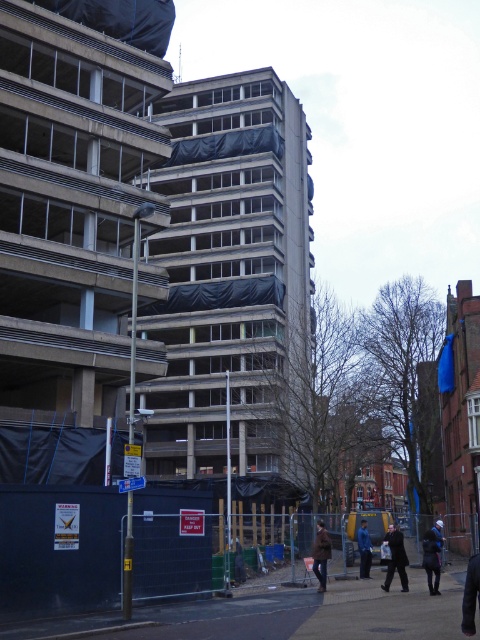
Question: Which point is closer to the camera?

Choices:
 (A) brown asphalt pavement at lower center
 (B) dark blue jeans at lower right

Answer: (B)

Question: From the image, what is the correct spatial relationship of dark gray coat at center in relation to dark blue jacket at lower right?

Choices:
 (A) below
 (B) above

Answer: (A)

Question: Among these objects, which one is farthest from the camera?

Choices:
 (A) dark blue jacket at lower right
 (B) dark blue jeans at lower right
 (C) blue denim jacket at lower right

Answer: (C)

Question: Can you confirm if brown woolen coat at lower right is wider than blue denim jacket at lower right?

Choices:
 (A) no
 (B) yes

Answer: (B)

Question: Is dark gray coat at center wider than brown woolen coat at lower right?

Choices:
 (A) no
 (B) yes

Answer: (B)

Question: Which object is positioned closest to the brown asphalt pavement at lower center?

Choices:
 (A) dark blue jeans at lower right
 (B) brown woolen coat at lower right
 (C) dark gray coat at center

Answer: (B)